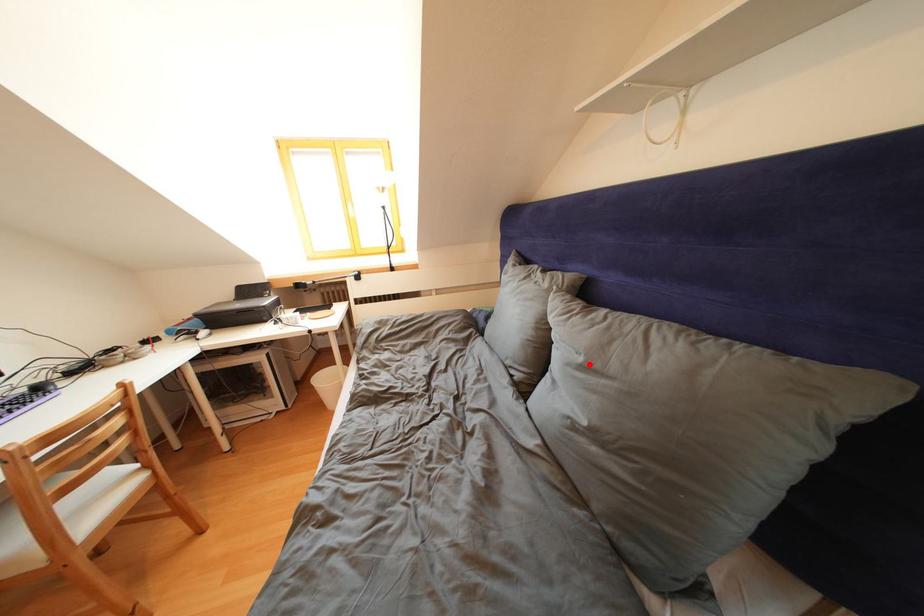
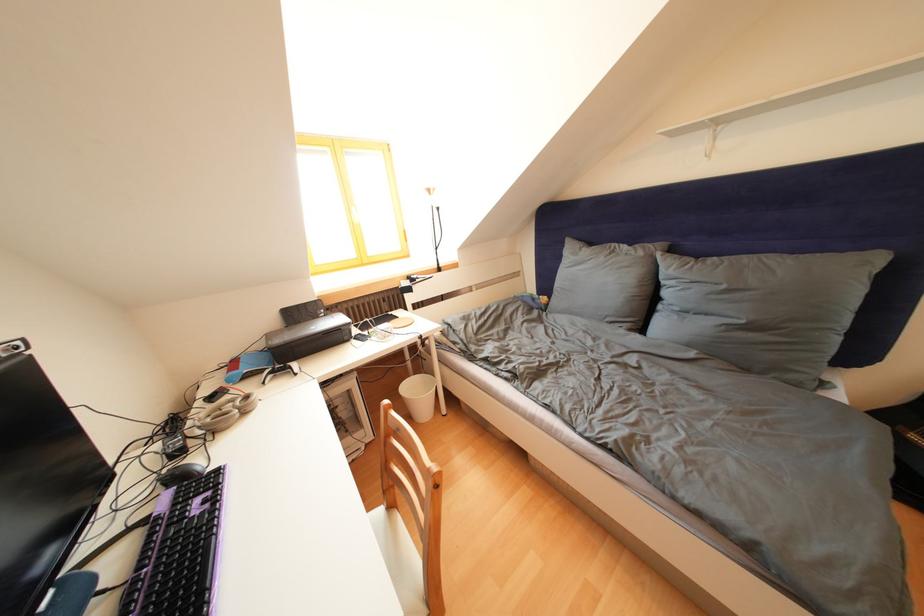
Locate, in the second image, the point that corresponds to the highlighted location in the first image.

(733, 292)